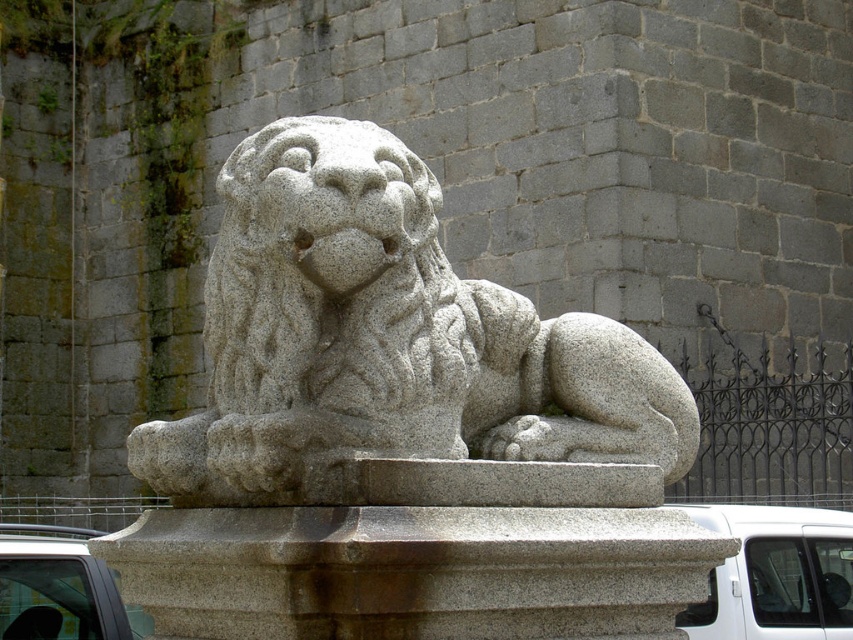
Can you confirm if granite lion at center is smaller than white matte van at lower right?

No, granite lion at center is not smaller than white matte van at lower right.

Looking at this image, who is positioned more to the left, granite lion at center or white matte van at lower right?

Positioned to the left is granite lion at center.

This screenshot has height=640, width=853. What do you see at coordinates (384, 340) in the screenshot?
I see `granite lion at center` at bounding box center [384, 340].

The image size is (853, 640). Identify the location of granite lion at center. (384, 340).

From the picture: Is white matte van at lower right bigger than white matte car at lower left?

No.

The image size is (853, 640). Identify the location of white matte van at lower right. (775, 573).

This screenshot has height=640, width=853. What are the coordinates of `white matte van at lower right` in the screenshot? It's located at (775, 573).

Between granite pedestal at center and white matte car at lower left, which one appears on the right side from the viewer's perspective?

granite pedestal at center

From the picture: Which is more to the left, granite pedestal at center or white matte car at lower left?

white matte car at lower left is more to the left.

Is point (630, 572) in front of point (76, 573)?

Yes, point (630, 572) is in front of point (76, 573).

Where is `granite pedestal at center`? This screenshot has width=853, height=640. granite pedestal at center is located at coordinates (413, 572).